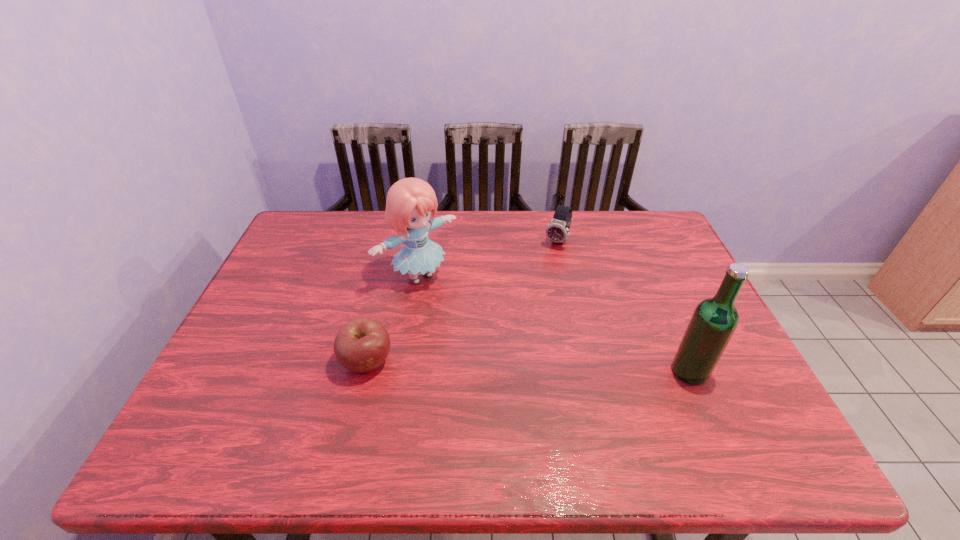
The height and width of the screenshot is (540, 960). Identify the location of vacant point located between the shortest object and the second object from right to left. (462, 302).

At what (x,y) coordinates should I click in order to perform the action: click on free spot between the third tallest object and the rightmost object. Please return your answer as a coordinate pair (x, y). The height and width of the screenshot is (540, 960). Looking at the image, I should click on (623, 306).

Locate an element on the screen. This screenshot has height=540, width=960. object that ranks as the second closest to the doll is located at coordinates (557, 231).

At what (x,y) coordinates should I click in order to perform the action: click on object that can be found as the third closest to the beer bottle. Please return your answer as a coordinate pair (x, y). Looking at the image, I should click on (362, 345).

Where is `free point that satisfies the following two spatial constraints: 1. on the back side of the second farthest object; 2. on the right side of the second shortest object`? The height and width of the screenshot is (540, 960). free point that satisfies the following two spatial constraints: 1. on the back side of the second farthest object; 2. on the right side of the second shortest object is located at coordinates (424, 241).

Locate an element on the screen. This screenshot has width=960, height=540. vacant point that satisfies the following two spatial constraints: 1. on the back side of the third tallest object; 2. on the left side of the second farthest object is located at coordinates (424, 241).

You are a GUI agent. You are given a task and a screenshot of the screen. Output one action in this format:
    pyautogui.click(x=<x>, y=<y>)
    Task: Click on the vacant space that satisfies the following two spatial constraints: 1. on the side of the rightmost object with the unique marking; 2. on the left side of the apple
    
    Given the screenshot: What is the action you would take?
    pyautogui.click(x=365, y=371)

Where is `vacant space that satisfies the following two spatial constraints: 1. on the front side of the third nearest object; 2. on the right side of the beer bottle`? This screenshot has width=960, height=540. vacant space that satisfies the following two spatial constraints: 1. on the front side of the third nearest object; 2. on the right side of the beer bottle is located at coordinates (404, 371).